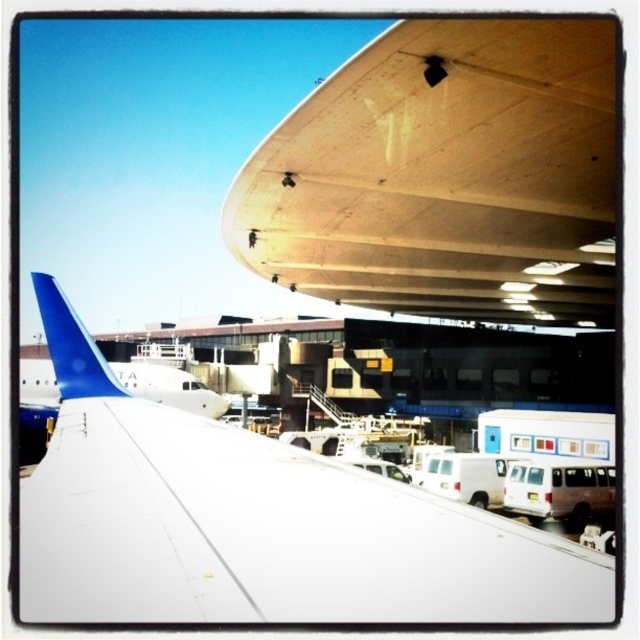
Question: Which object appears farthest from the camera in this image?

Choices:
 (A) white matte wing at upper center
 (B) wooden airplane wing at upper center

Answer: (B)

Question: Estimate the real-world distances between objects in this image. Which object is closer to the white matte wing at upper center?

Choices:
 (A) wooden airplane wing at upper center
 (B) blue matte airplane tail at left

Answer: (B)

Question: Which of the following is the closest to the observer?

Choices:
 (A) blue matte airplane tail at left
 (B) white matte wing at upper center
 (C) wooden airplane wing at upper center

Answer: (B)

Question: In this image, where is white matte wing at upper center located relative to blue matte airplane tail at left?

Choices:
 (A) below
 (B) above

Answer: (B)

Question: Is wooden airplane wing at upper center behind blue matte airplane tail at left?

Choices:
 (A) yes
 (B) no

Answer: (B)

Question: Observing the image, what is the correct spatial positioning of wooden airplane wing at upper center in reference to white matte wing at upper center?

Choices:
 (A) below
 (B) above

Answer: (B)